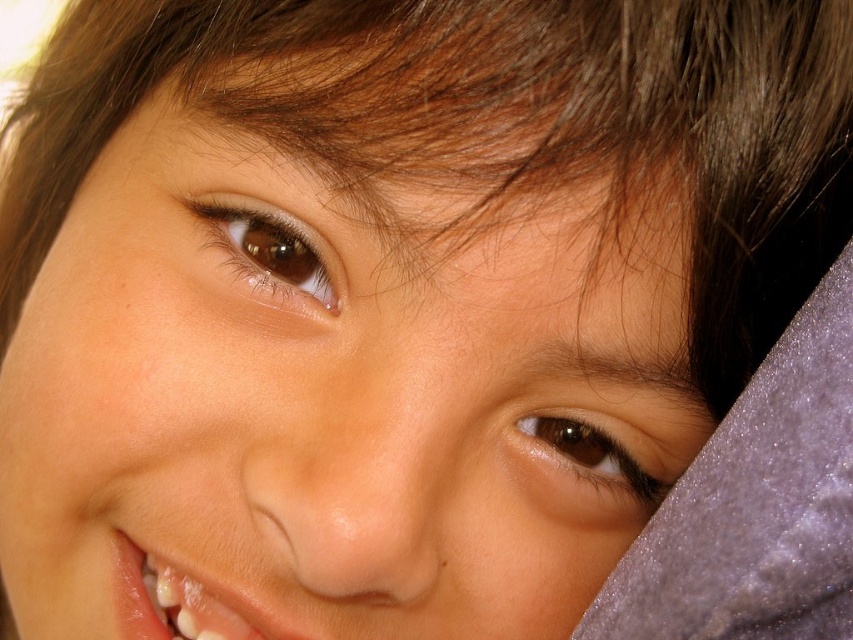
Question: Can you confirm if brown shiny eye at upper center is smaller than brown shiny eye at lower right?

Choices:
 (A) yes
 (B) no

Answer: (A)

Question: Among these objects, which one is farthest from the camera?

Choices:
 (A) brown shiny eye at upper center
 (B) brown shiny eye at lower right

Answer: (B)

Question: Which point is farther to the camera?

Choices:
 (A) brown shiny eye at upper center
 (B) brown shiny eye at lower right

Answer: (B)

Question: From the image, what is the correct spatial relationship of brown shiny eye at upper center in relation to brown shiny eye at lower right?

Choices:
 (A) below
 (B) above

Answer: (B)

Question: Can you confirm if brown shiny eye at upper center is positioned to the left of brown shiny eye at lower right?

Choices:
 (A) no
 (B) yes

Answer: (B)

Question: Which point is closer to the camera?

Choices:
 (A) (535, 420)
 (B) (218, 204)

Answer: (B)